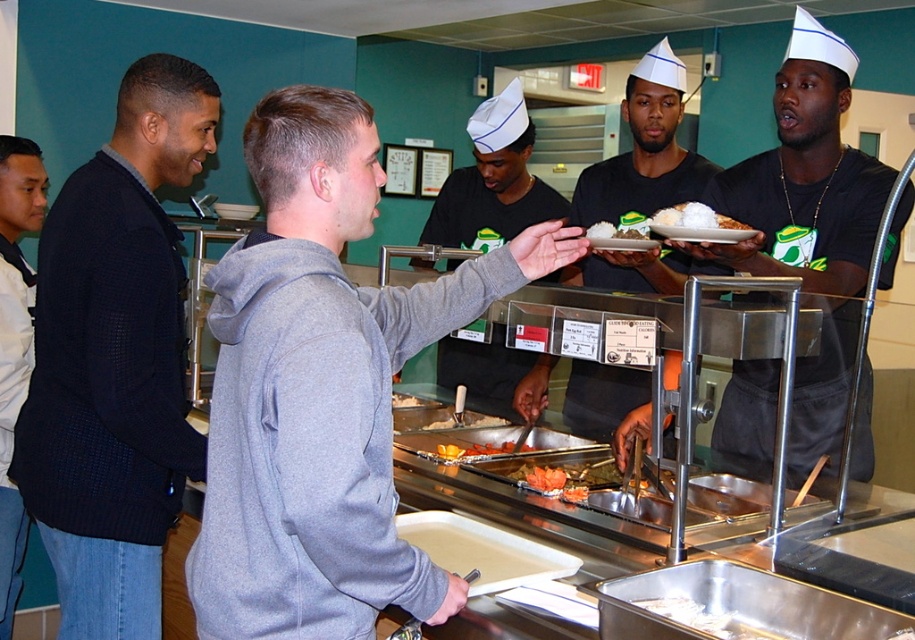
Question: Is orange glazed pastry at center positioned before orange glazed salmon at center?

Choices:
 (A) no
 (B) yes

Answer: (A)

Question: Which object is the closest to the white shirt at left?

Choices:
 (A) orange plastic tray at center
 (B) dark blue sweater at left
 (C) white paper hat at center
 (D) white glossy rice at center

Answer: (B)

Question: Can you confirm if orange glazed pastry at center is smaller than white glossy rice at center?

Choices:
 (A) yes
 (B) no

Answer: (B)

Question: Which object appears farthest from the camera in this image?

Choices:
 (A) orange glazed pastry at center
 (B) dark blue sweater at left
 (C) white rice at center
 (D) orange glazed salmon at center

Answer: (A)

Question: Which point is closer to the camera?

Choices:
 (A) gray hoodie at center
 (B) orange glazed salmon at center
 (C) matte black shirt at center
 (D) orange plastic tray at center

Answer: (A)

Question: Does dark blue sweater at left have a greater width compared to matte black shirt at center?

Choices:
 (A) yes
 (B) no

Answer: (A)